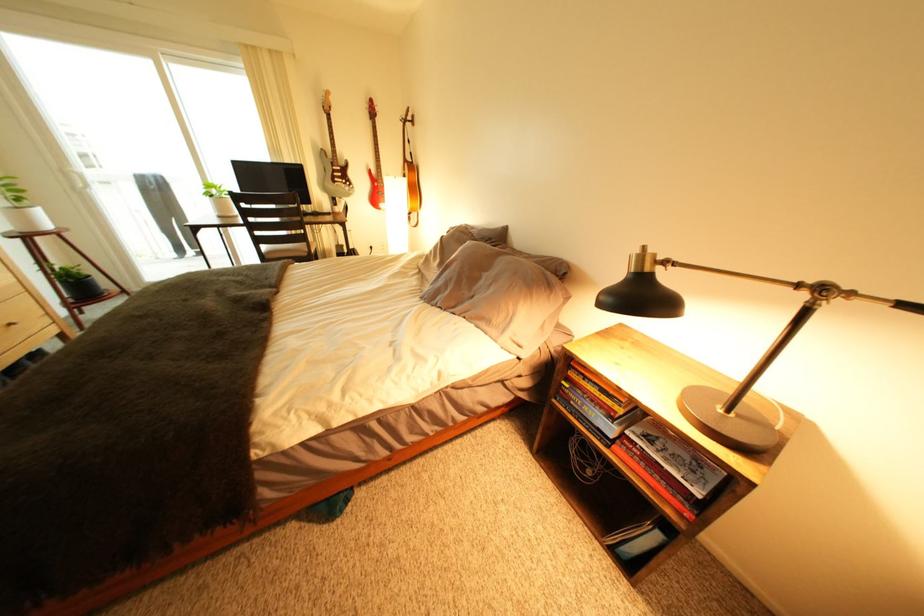
Where is `chair sitting surface`? chair sitting surface is located at coordinates (286, 252).